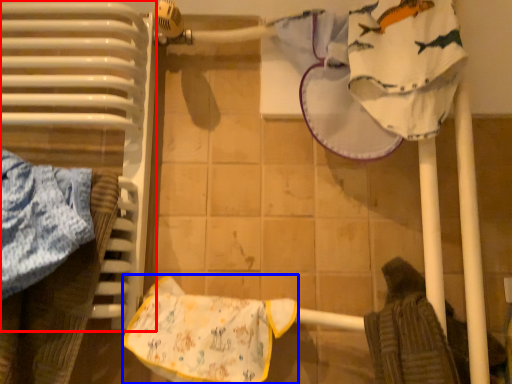
Question: Which object appears farthest to the camera in this image, radiator (highlighted by a red box) or material (highlighted by a blue box)?

Choices:
 (A) radiator
 (B) material

Answer: (B)